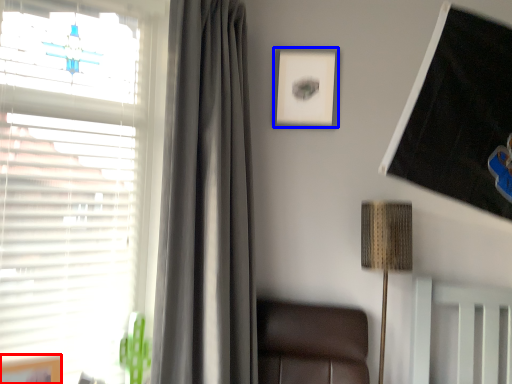
Question: Which of the following is the farthest to the observer, picture frame (highlighted by a red box) or picture frame (highlighted by a blue box)?

Choices:
 (A) picture frame
 (B) picture frame

Answer: (B)